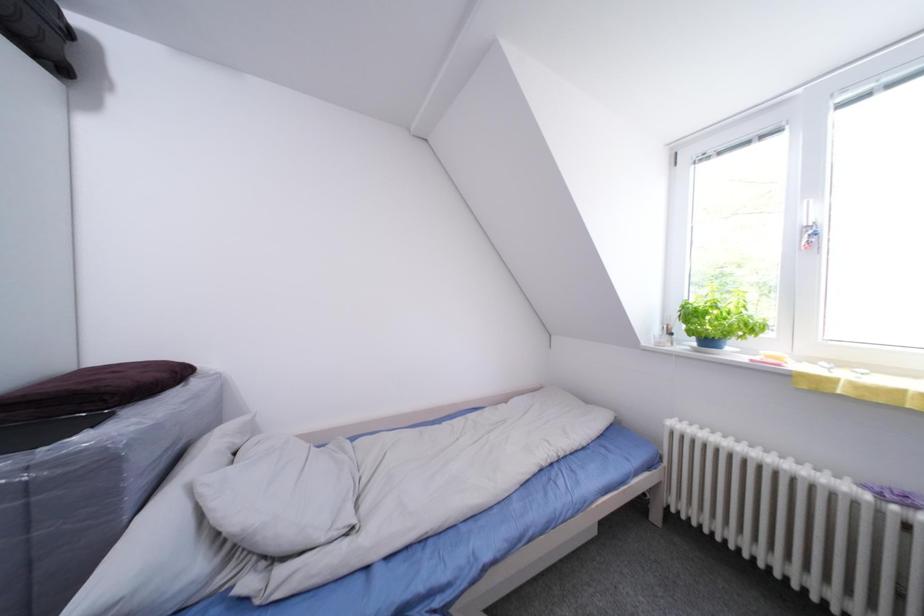
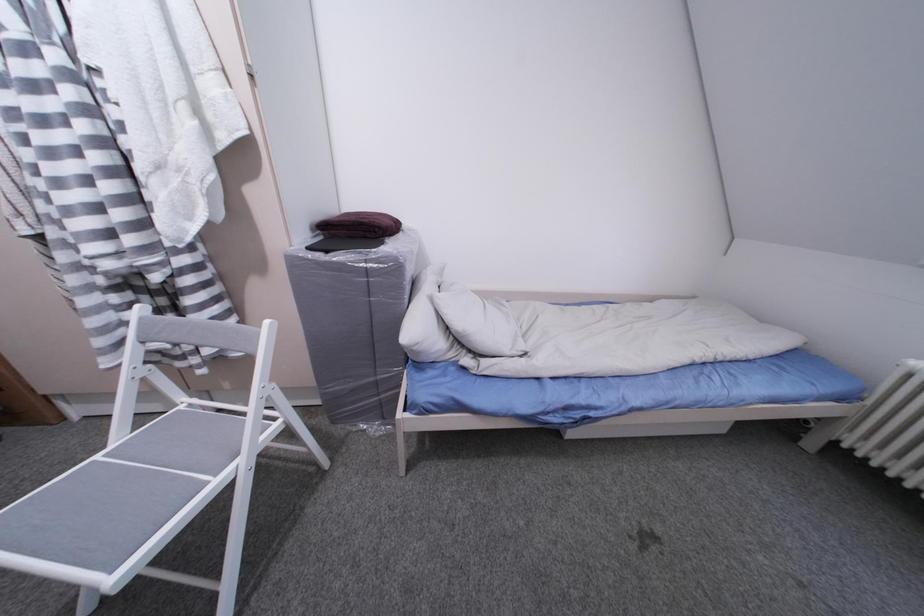
How did the camera likely rotate?

The camera's rotation is toward left-down.